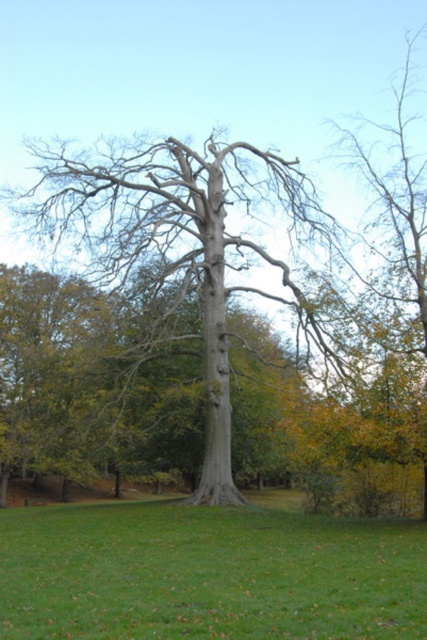
Question: Is green grass at center above gray bark tree at center?

Choices:
 (A) no
 (B) yes

Answer: (A)

Question: Which object appears farthest from the camera in this image?

Choices:
 (A) green grass at center
 (B) gray bark tree at center

Answer: (B)

Question: Among these points, which one is nearest to the camera?

Choices:
 (A) (208, 579)
 (B) (218, 358)

Answer: (A)

Question: From the image, what is the correct spatial relationship of green grass at center in relation to gray bark tree at center?

Choices:
 (A) above
 (B) below

Answer: (B)

Question: Does green grass at center come in front of gray bark tree at center?

Choices:
 (A) yes
 (B) no

Answer: (A)